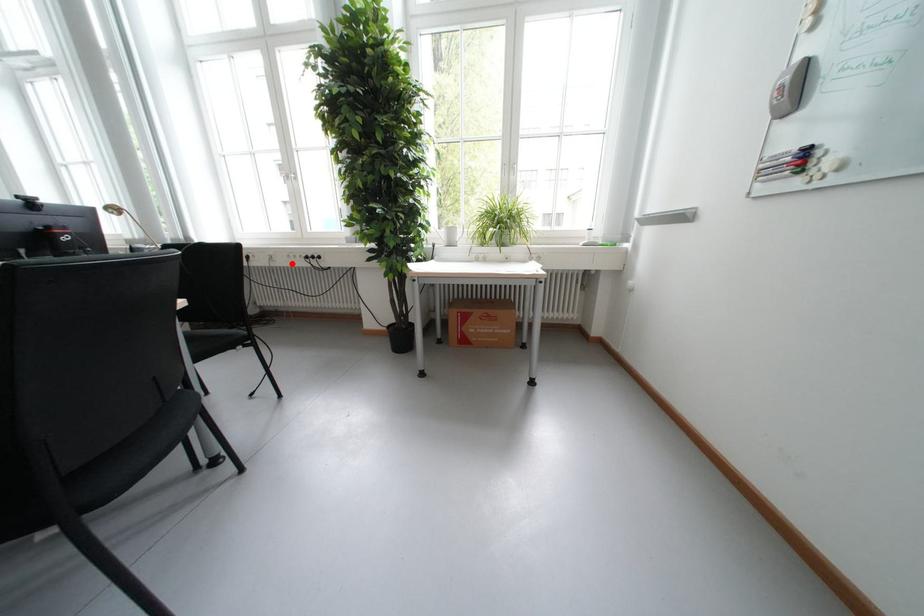
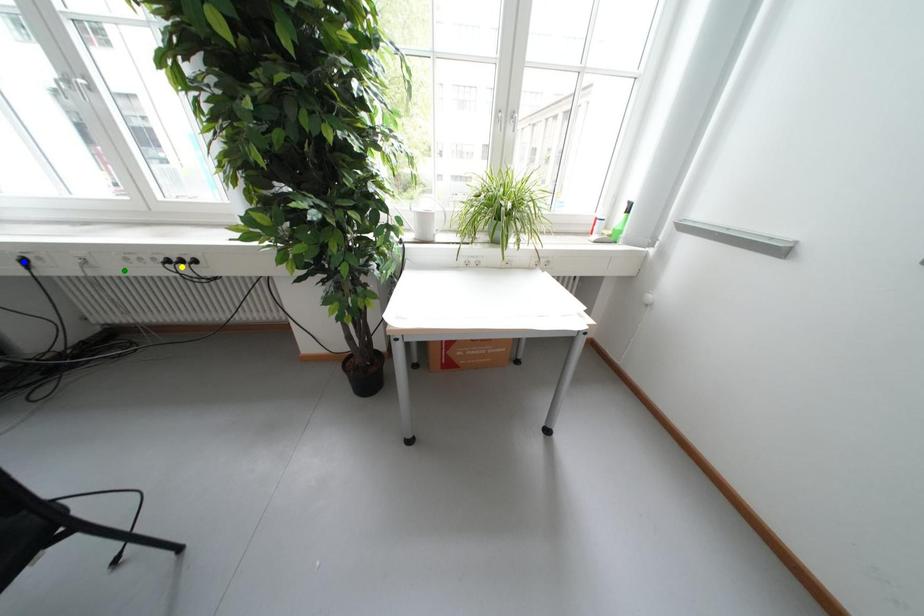
Question: I am providing you with two images of the same scene from different viewpoints. A red point is marked on the first image. You are given multiple points on the second image. Which point in image 2 represents the same 3d spot as the red point in image 1?

Choices:
 (A) blue point
 (B) yellow point
 (C) green point

Answer: (C)